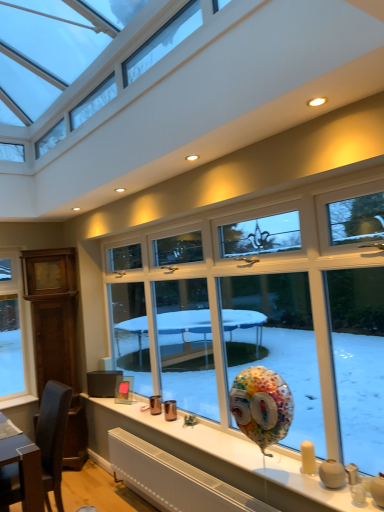
Question: Would you say matte white vase at lower right is inside or outside yellow matte candle at lower right?

Choices:
 (A) outside
 (B) inside

Answer: (A)

Question: In terms of size, does matte white vase at lower right appear bigger or smaller than yellow matte candle at lower right?

Choices:
 (A) small
 (B) big

Answer: (B)

Question: From the image's perspective, relative to yellow matte candle at lower right, is matte white vase at lower right above or below?

Choices:
 (A) below
 (B) above

Answer: (A)

Question: Is yellow matte candle at lower right inside the boundaries of matte white vase at lower right, or outside?

Choices:
 (A) outside
 (B) inside

Answer: (A)

Question: From the image's perspective, is yellow matte candle at lower right above or below matte white vase at lower right?

Choices:
 (A) below
 (B) above

Answer: (B)

Question: Considering the positions of yellow matte candle at lower right and matte white vase at lower right in the image, is yellow matte candle at lower right bigger or smaller than matte white vase at lower right?

Choices:
 (A) big
 (B) small

Answer: (B)

Question: In terms of height, does yellow matte candle at lower right look taller or shorter compared to matte white vase at lower right?

Choices:
 (A) short
 (B) tall

Answer: (B)